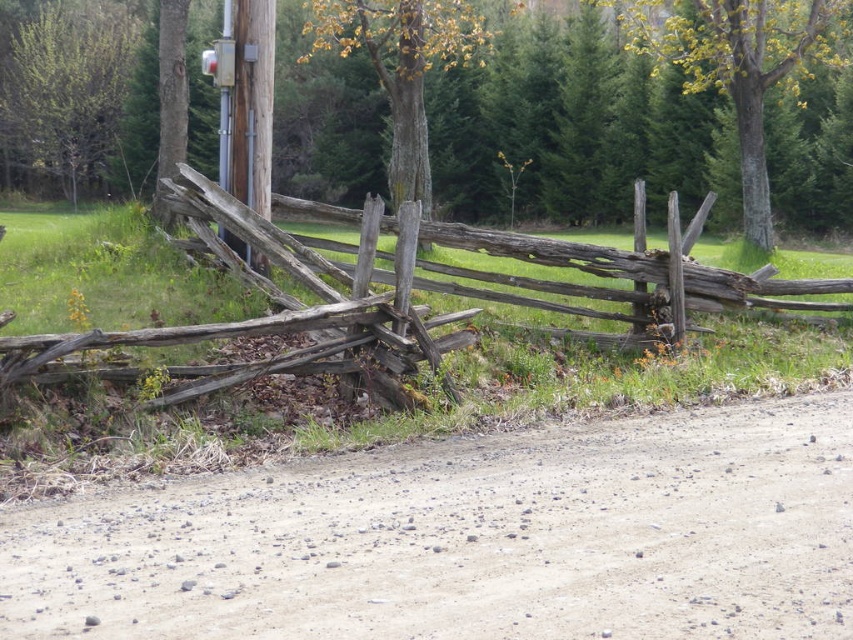
From the picture: You are standing on the dirt road in the lower portion of the image. You see a point marked at coordinates [573,131]. What object does this point represent?

The point at coordinates [573,131] represents the smooth brown tree trunk at upper center.

You are a hiker carrying a backpack with a 1.2 meter wide tent. You see the smooth brown tree trunk at upper center and the smooth brown wood at upper right. Which tree trunk can you place your tent next to without it overlapping?

The smooth brown tree trunk at upper center has a larger width than the smooth brown wood at upper right, so placing the tent next to the smooth brown tree trunk at upper center would provide enough space to avoid overlapping with the tree trunk.